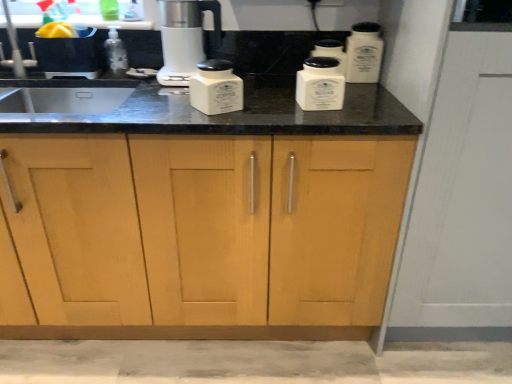
What do you see at coordinates (184, 38) in the screenshot?
I see `satin white coffee maker at center` at bounding box center [184, 38].

What do you see at coordinates (268, 229) in the screenshot?
I see `light wood cabinet at center` at bounding box center [268, 229].

The image size is (512, 384). Describe the element at coordinates (115, 53) in the screenshot. I see `transparent plastic bottle at left` at that location.

Locate an element on the screen. This screenshot has width=512, height=384. white ceramic sugar container at upper center, which is counted as the third kitchen appliance, starting from the left is located at coordinates (331, 52).

Measure the distance between point (x=323, y=53) and camera.

Point (x=323, y=53) and camera are 1.45 meters apart from each other.

Where is `white ceramic container at upper right, which ranks as the 4th kitchen appliance in left-to-right order`? This screenshot has width=512, height=384. white ceramic container at upper right, which ranks as the 4th kitchen appliance in left-to-right order is located at coordinates (364, 53).

The height and width of the screenshot is (384, 512). Describe the element at coordinates (216, 88) in the screenshot. I see `white ceramic container at center, which is the 4th kitchen appliance from right to left` at that location.

At what (x,y) coordinates should I click in order to perform the action: click on satin white coffee maker at center. Please return your answer as a coordinate pair (x, y). Looking at the image, I should click on (184, 38).

In the image, is light wood cabinet at center on the left side or the right side of white ceramic container at center, which is the 4th kitchen appliance from right to left?

Based on their positions, light wood cabinet at center is located to the left of white ceramic container at center, which is the 4th kitchen appliance from right to left.

Considering the relative sizes of light wood cabinet at center and white ceramic container at center, positioned as the first kitchen appliance in left-to-right order, in the image provided, is light wood cabinet at center thinner than white ceramic container at center, positioned as the first kitchen appliance in left-to-right order,?

In fact, light wood cabinet at center might be wider than white ceramic container at center, positioned as the first kitchen appliance in left-to-right order.

Considering the points (258, 292) and (239, 105), which point is behind, point (258, 292) or point (239, 105)?

Positioned behind is point (258, 292).

Considering the sizes of objects satin white coffee maker at center and white ceramic container at upper right, the 1th kitchen appliance positioned from the right, in the image provided, who is bigger, satin white coffee maker at center or white ceramic container at upper right, the 1th kitchen appliance positioned from the right,?

satin white coffee maker at center is bigger.

Is satin white coffee maker at center positioned beyond the bounds of white ceramic container at upper right, which ranks as the 4th kitchen appliance in left-to-right order?

Yes, satin white coffee maker at center is located beyond the bounds of white ceramic container at upper right, which ranks as the 4th kitchen appliance in left-to-right order.

Based on the photo, from a real-world perspective, is satin white coffee maker at center on white ceramic container at upper right, the 1th kitchen appliance positioned from the right?

Yes, from a real-world perspective, satin white coffee maker at center is above white ceramic container at upper right, the 1th kitchen appliance positioned from the right.

Is white ceramic container at center, the 3th kitchen appliance from the right, surrounding light wood cabinet at center?

No, white ceramic container at center, the 3th kitchen appliance from the right, does not contain light wood cabinet at center.

Is white ceramic container at center, which is the second kitchen appliance from left to right, shorter than light wood cabinet at center?

Yes.

Is white ceramic container at center, the 3th kitchen appliance from the right, aimed at light wood cabinet at center?

Yes.

Which of these two, satin white coffee maker at center or white ceramic container at center, the 3th kitchen appliance from the right, is bigger?

satin white coffee maker at center is bigger.

From the image's perspective, is satin white coffee maker at center over white ceramic container at center, the 3th kitchen appliance from the right?

Yes, from the image's perspective, satin white coffee maker at center is on top of white ceramic container at center, the 3th kitchen appliance from the right.

Is there a large distance between satin white coffee maker at center and white ceramic container at center, which is the second kitchen appliance from left to right?

That's not correct — satin white coffee maker at center is a little close to white ceramic container at center, which is the second kitchen appliance from left to right.

Is satin white coffee maker at center further to the viewer compared to white ceramic container at center, the 3th kitchen appliance from the right?

Yes, satin white coffee maker at center is further from the camera.

Considering the positions of points (375, 66) and (312, 51), is point (375, 66) farther from camera compared to point (312, 51)?

That is True.

Does white ceramic container at upper right, the 1th kitchen appliance positioned from the right, come behind white ceramic sugar container at upper center, which is counted as the third kitchen appliance, starting from the left?

That is False.

Looking at their sizes, would you say white ceramic container at upper right, which ranks as the 4th kitchen appliance in left-to-right order, is wider or thinner than white ceramic sugar container at upper center, the 2th kitchen appliance when ordered from right to left?

white ceramic container at upper right, which ranks as the 4th kitchen appliance in left-to-right order, is wider than white ceramic sugar container at upper center, the 2th kitchen appliance when ordered from right to left.

Locate an element on the screen. The height and width of the screenshot is (384, 512). kitchen appliance lying behind the white ceramic container at upper right, which ranks as the 4th kitchen appliance in left-to-right order is located at coordinates (331, 52).

In terms of height, does white ceramic sugar container at upper center, which is counted as the third kitchen appliance, starting from the left, look taller or shorter compared to light wood cabinet at center?

Clearly, white ceramic sugar container at upper center, which is counted as the third kitchen appliance, starting from the left, is shorter compared to light wood cabinet at center.

From a real-world perspective, is white ceramic sugar container at upper center, the 2th kitchen appliance when ordered from right to left, on light wood cabinet at center?

Yes, from a real-world perspective, white ceramic sugar container at upper center, the 2th kitchen appliance when ordered from right to left, is above light wood cabinet at center.

Would you say light wood cabinet at center is part of white ceramic sugar container at upper center, which is counted as the third kitchen appliance, starting from the left,'s contents?

No, light wood cabinet at center is not surrounded by white ceramic sugar container at upper center, which is counted as the third kitchen appliance, starting from the left.

Is white ceramic sugar container at upper center, the 2th kitchen appliance when ordered from right to left, turned away from light wood cabinet at center?

Absolutely, white ceramic sugar container at upper center, the 2th kitchen appliance when ordered from right to left, is directed away from light wood cabinet at center.

Choose the correct answer: Is white ceramic container at center, positioned as the first kitchen appliance in left-to-right order, inside transparent plastic bottle at left or outside it?

white ceramic container at center, positioned as the first kitchen appliance in left-to-right order, cannot be found inside transparent plastic bottle at left.

Can you confirm if white ceramic container at center, which is the 4th kitchen appliance from right to left, is smaller than transparent plastic bottle at left?

A: No, white ceramic container at center, which is the 4th kitchen appliance from right to left, is not smaller than transparent plastic bottle at left.

From a real-world perspective, which is physically above, white ceramic container at center, positioned as the first kitchen appliance in left-to-right order, or transparent plastic bottle at left?

transparent plastic bottle at left, from a real-world perspective.

Can you confirm if white ceramic container at center, which is the 4th kitchen appliance from right to left, is thinner than transparent plastic bottle at left?

No, white ceramic container at center, which is the 4th kitchen appliance from right to left, is not thinner than transparent plastic bottle at left.

Where is `cabinetry lying below the white ceramic container at center, which is the 4th kitchen appliance from right to left (from the image's perspective)`? The height and width of the screenshot is (384, 512). cabinetry lying below the white ceramic container at center, which is the 4th kitchen appliance from right to left (from the image's perspective) is located at coordinates (268, 229).

Identify the location of the 4th kitchen appliance counting from the right side of the satin white coffee maker at center. The height and width of the screenshot is (384, 512). (364, 53).

Considering their positions, is white ceramic container at center, positioned as the first kitchen appliance in left-to-right order, positioned closer to light wood cabinet at center than white ceramic container at upper right, which ranks as the 4th kitchen appliance in left-to-right order?

white ceramic container at center, positioned as the first kitchen appliance in left-to-right order, is positioned closer to the anchor light wood cabinet at center.

Considering their positions, is satin white coffee maker at center positioned closer to white ceramic sugar container at upper center, which is counted as the third kitchen appliance, starting from the left, than light wood cabinet at center?

Among the two, satin white coffee maker at center is located nearer to white ceramic sugar container at upper center, which is counted as the third kitchen appliance, starting from the left.

Estimate the real-world distances between objects in this image. Which object is further from white ceramic container at center, positioned as the first kitchen appliance in left-to-right order, white ceramic sugar container at upper center, which is counted as the third kitchen appliance, starting from the left, or satin white coffee maker at center?

white ceramic sugar container at upper center, which is counted as the third kitchen appliance, starting from the left, lies further to white ceramic container at center, positioned as the first kitchen appliance in left-to-right order, than the other object.

Based on their spatial positions, is transparent plastic bottle at left or white ceramic container at center, which is the 4th kitchen appliance from right to left, further from satin white coffee maker at center?

Based on the image, white ceramic container at center, which is the 4th kitchen appliance from right to left, appears to be further to satin white coffee maker at center.

When comparing their distances from white ceramic sugar container at upper center, the 2th kitchen appliance when ordered from right to left, does white ceramic container at center, positioned as the first kitchen appliance in left-to-right order, or transparent plastic bottle at left seem closer?

The object closer to white ceramic sugar container at upper center, the 2th kitchen appliance when ordered from right to left, is white ceramic container at center, positioned as the first kitchen appliance in left-to-right order.

Estimate the real-world distances between objects in this image. Which object is further from light wood cabinet at center, white ceramic sugar container at upper center, the 2th kitchen appliance when ordered from right to left, or satin white coffee maker at center?

satin white coffee maker at center lies further to light wood cabinet at center than the other object.

Estimate the real-world distances between objects in this image. Which object is closer to white ceramic container at center, the 3th kitchen appliance from the right, white ceramic sugar container at upper center, the 2th kitchen appliance when ordered from right to left, or transparent plastic bottle at left?

Based on the image, white ceramic sugar container at upper center, the 2th kitchen appliance when ordered from right to left, appears to be nearer to white ceramic container at center, the 3th kitchen appliance from the right.

Considering their positions, is satin white coffee maker at center positioned further to transparent plastic bottle at left than white ceramic container at upper right, the 1th kitchen appliance positioned from the right?

Among the two, white ceramic container at upper right, the 1th kitchen appliance positioned from the right, is located further to transparent plastic bottle at left.

Where is `cabinetry between transparent plastic bottle at left and white ceramic container at center, the 3th kitchen appliance from the right`? cabinetry between transparent plastic bottle at left and white ceramic container at center, the 3th kitchen appliance from the right is located at coordinates (268, 229).

The image size is (512, 384). I want to click on home appliance between transparent plastic bottle at left and white ceramic sugar container at upper center, the 2th kitchen appliance when ordered from right to left, in the horizontal direction, so (x=184, y=38).

Identify the location of cabinetry between transparent plastic bottle at left and white ceramic sugar container at upper center, the 2th kitchen appliance when ordered from right to left, from left to right. The image size is (512, 384). (268, 229).

Image resolution: width=512 pixels, height=384 pixels. In order to click on kitchen appliance positioned between white ceramic container at center, which is the second kitchen appliance from left to right, and white ceramic sugar container at upper center, the 2th kitchen appliance when ordered from right to left, from near to far in this screenshot , I will do `click(364, 53)`.